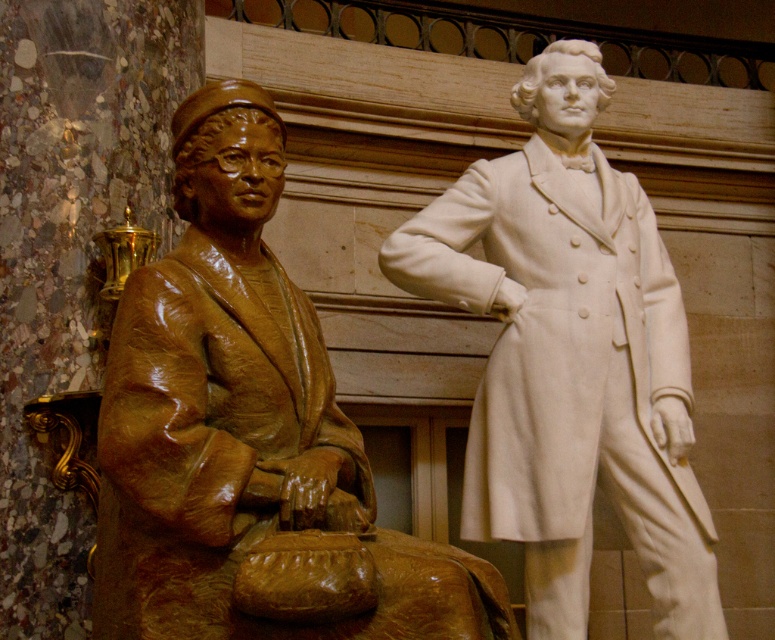
You are an art curator assessing the placement of two statues in a gallery. The bronze statue at left and the white marble statue at right are positioned side by side. Based on their sizes, which statue would you recommend placing on a higher pedestal to ensure both appear balanced in the exhibition?

The bronze statue at left has a lesser height compared to the white marble statue at right, so placing the bronze statue at left on a higher pedestal would balance their overall visual heights in the exhibition.

Based on the photo, you are an art student standing in front of the two statues. You want to take a photo of both statues but your camera can only focus on objects within 2 meters. Since you are standing 1.5 meters away from the bronze statue at left, will the white marble statue at right also be in focus?

The bronze statue at left is closer to the viewer than the white marble statue at right. Since you are 1.5 meters away from the bronze statue at left, the white marble statue at right is farther away. If your camera focuses on the bronze statue at left, the white marble statue at right might be slightly out of focus depending on the camera lens. However, if the distance between them is within the depth of field, both could be in focus. Without specific lens details, it is uncertain.